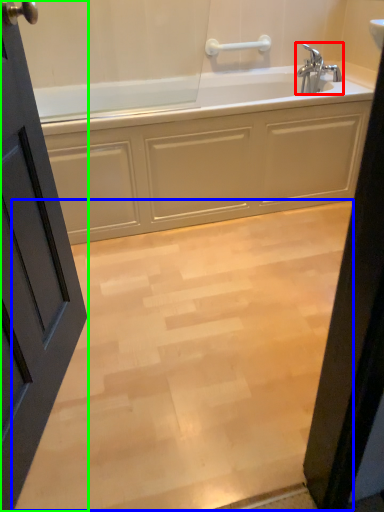
Question: Which object is the farthest from tap (highlighted by a red box)? Choose among these: plain (highlighted by a blue box) or door (highlighted by a green box).

Choices:
 (A) plain
 (B) door

Answer: (B)